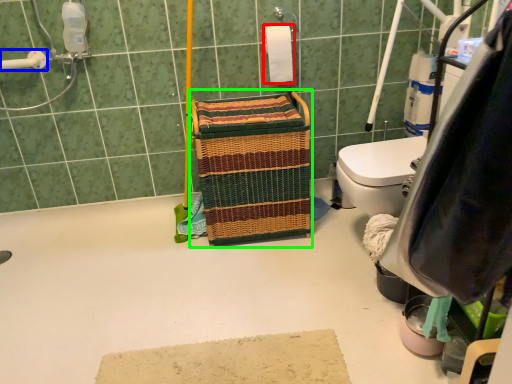
Question: Based on their relative distances, which object is farther from toilet paper (highlighted by a red box)? Choose from shower (highlighted by a blue box) and laundry basket (highlighted by a green box).

Choices:
 (A) shower
 (B) laundry basket

Answer: (A)